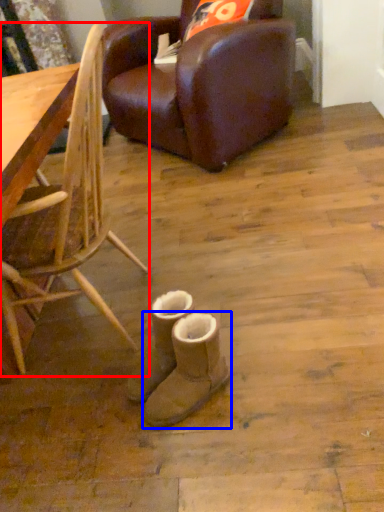
Question: Among these objects, which one is farthest to the camera, chair (highlighted by a red box) or footwear (highlighted by a blue box)?

Choices:
 (A) chair
 (B) footwear

Answer: (B)